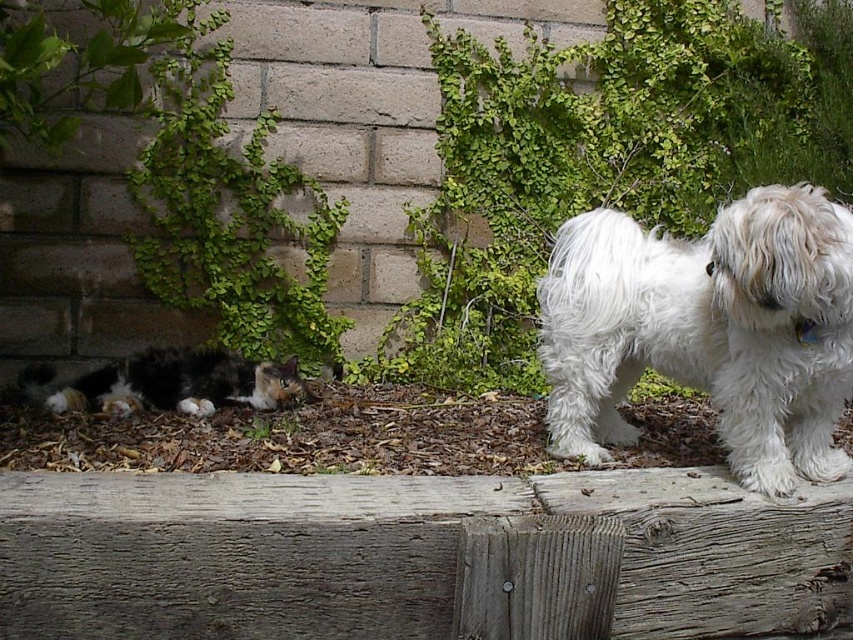
You are a person standing at the center of the scene. You want to toss a treat to the calico fur cat at lower left without disturbing the white fluffy dog at right. Given that the treat can travel 5 feet, will the treat reach the cat?

The white fluffy dog at right is 5.19 feet away from the calico fur cat at lower left. Since the treat can only travel 5 feet, it won not reach the cat.

You are a photographer trying to capture both the white fluffy dog at right and the calico fur cat at lower left in the same frame. Given their sizes, which animal would you need to position closer to the camera to ensure they appear similar in size in the photo?

Since the white fluffy dog at right is narrower than the calico fur cat at lower left, you should position the white fluffy dog at right closer to the camera to make them appear similar in size.